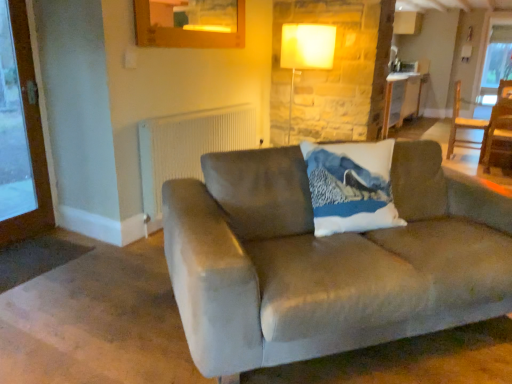
Question: Is wooden chair at right to the left of wooden table at center from the viewer's perspective?

Choices:
 (A) no
 (B) yes

Answer: (A)

Question: Considering the relative sizes of wooden chair at right and wooden table at center in the image provided, is wooden chair at right bigger than wooden table at center?

Choices:
 (A) yes
 (B) no

Answer: (B)

Question: From a real-world perspective, is wooden chair at right under wooden table at center?

Choices:
 (A) no
 (B) yes

Answer: (B)

Question: Considering the relative sizes of wooden chair at right and wooden table at center in the image provided, is wooden chair at right thinner than wooden table at center?

Choices:
 (A) yes
 (B) no

Answer: (A)

Question: Would you consider wooden chair at right to be distant from wooden table at center?

Choices:
 (A) no
 (B) yes

Answer: (B)

Question: Can you confirm if wooden chair at right is shorter than wooden table at center?

Choices:
 (A) no
 (B) yes

Answer: (B)

Question: Does white textured radiator at upper center have a greater height compared to wooden screen door at left?

Choices:
 (A) yes
 (B) no

Answer: (B)

Question: Would you say white textured radiator at upper center contains wooden screen door at left?

Choices:
 (A) no
 (B) yes

Answer: (A)

Question: Does white textured radiator at upper center have a greater width compared to wooden screen door at left?

Choices:
 (A) no
 (B) yes

Answer: (B)

Question: Is white textured radiator at upper center thinner than wooden screen door at left?

Choices:
 (A) no
 (B) yes

Answer: (A)

Question: From the image's perspective, is white textured radiator at upper center under wooden screen door at left?

Choices:
 (A) yes
 (B) no

Answer: (A)

Question: Is white textured radiator at upper center in contact with wooden screen door at left?

Choices:
 (A) yes
 (B) no

Answer: (B)

Question: Does wooden chair at right have a greater width compared to matte white lamp at upper center?

Choices:
 (A) no
 (B) yes

Answer: (A)